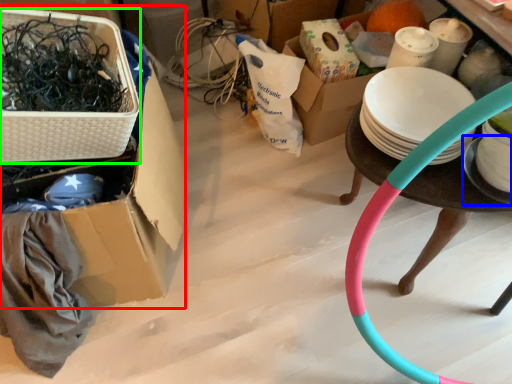
Question: Estimate the real-world distances between objects in this image. Which object is closer to box (highlighted by a red box), plate (highlighted by a blue box) or basket (highlighted by a green box)?

Choices:
 (A) plate
 (B) basket

Answer: (B)